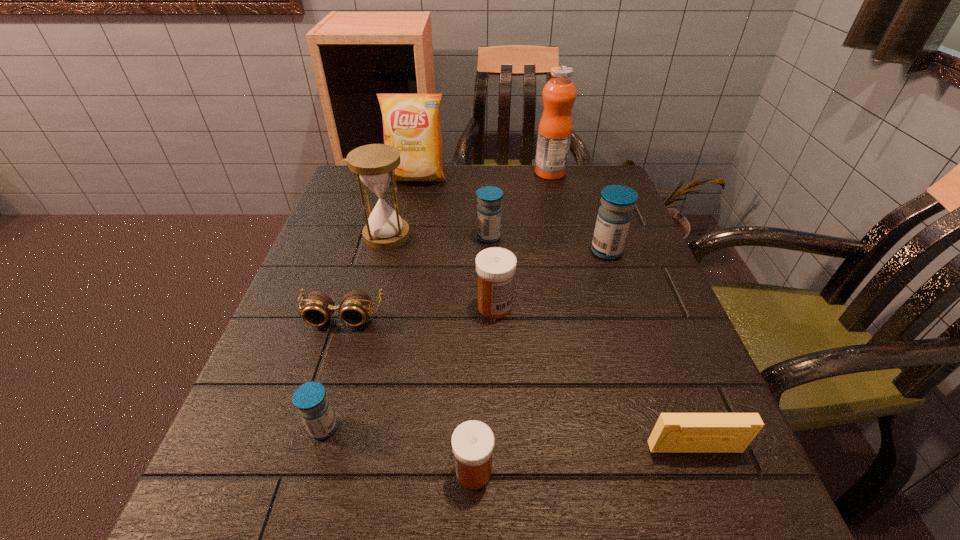
This screenshot has height=540, width=960. In the image, there is a desktop. Find the location of `vacant area at the right edge`. vacant area at the right edge is located at coordinates (669, 360).

Locate an element on the screen. free space that is in between the second smallest blue medicine and the smaller white medicine is located at coordinates (481, 354).

You are a GUI agent. You are given a task and a screenshot of the screen. Output one action in this format:
    pyautogui.click(x=<x>, y=<y>)
    Task: Click on the vacant space in between the second blue medicine from right to left and the tallest object
    
    Given the screenshot: What is the action you would take?
    pyautogui.click(x=519, y=205)

I want to click on vacant space that is in between the smaller white medicine and the hourglass, so click(x=430, y=353).

You are a GUI agent. You are given a task and a screenshot of the screen. Output one action in this format:
    pyautogui.click(x=<x>, y=<y>)
    Task: Click on the free space between the nearest blue medicine and the second blue medicine from left to right
    The width and height of the screenshot is (960, 540).
    Given the screenshot: What is the action you would take?
    pyautogui.click(x=406, y=333)

Locate an element on the screen. The width and height of the screenshot is (960, 540). vacant region between the brown goggles and the second smallest blue medicine is located at coordinates (415, 277).

You are a GUI agent. You are given a task and a screenshot of the screen. Output one action in this format:
    pyautogui.click(x=<x>, y=<y>)
    Task: Click on the blank region between the hourglass and the smaller white medicine
    This screenshot has height=540, width=960.
    Given the screenshot: What is the action you would take?
    pyautogui.click(x=430, y=353)

The width and height of the screenshot is (960, 540). Identify the location of empty space that is in between the second blue medicine from right to left and the tallest medicine. pyautogui.click(x=548, y=244).

You are a GUI agent. You are given a task and a screenshot of the screen. Output one action in this format:
    pyautogui.click(x=<x>, y=<y>)
    Task: Click on the vacant area between the tallest medicine and the eighth object from left to right
    
    Given the screenshot: What is the action you would take?
    pyautogui.click(x=578, y=212)

Find the location of a particular element. The height and width of the screenshot is (540, 960). free spot between the nearest blue medicine and the hourglass is located at coordinates point(355,332).